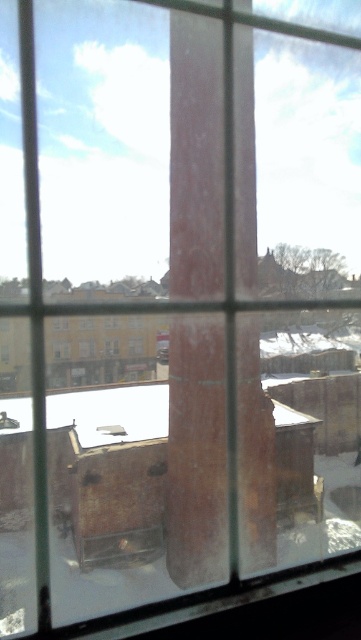
Describe the element at coordinates (197, 451) in the screenshot. Image resolution: width=361 pixels, height=640 pixels. I see `brown wood pillar at center` at that location.

Is point (171, 332) farther from viewer compared to point (89, 339)?

No, it is in front of (89, 339).

Is point (193, 444) less distant than point (84, 352)?

Yes, it is in front of point (84, 352).

Locate an element on the screen. Image resolution: width=361 pixels, height=640 pixels. brown wood pillar at center is located at coordinates (197, 451).